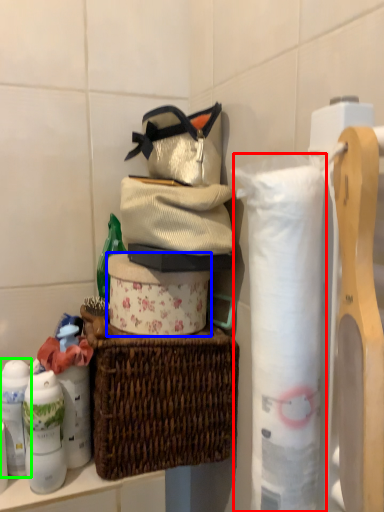
Question: Which object is positioned closest to toilet paper (highlighted by a red box)? Select from toilet paper (highlighted by a blue box) and toiletry (highlighted by a green box).

Choices:
 (A) toilet paper
 (B) toiletry

Answer: (A)